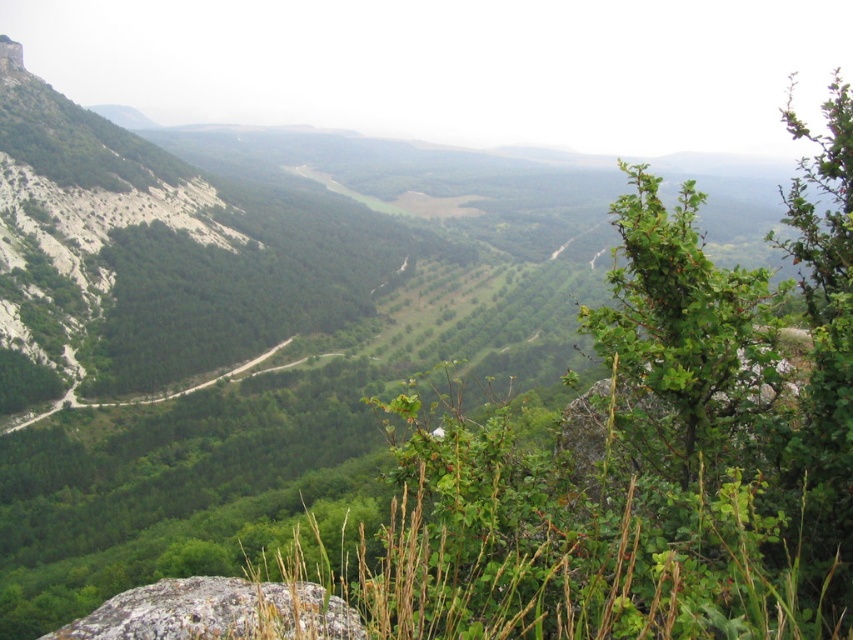
You are a hiker standing at the base of the gray rough rock at lower left and want to reach the smooth rock peak at upper left. Which rock is taller and requires more effort to climb?

The gray rough rock at lower left is taller than the smooth rock peak at upper left, so it would require more effort to climb.

You are standing at the top of the rocky outcrop looking down at the valley. There are two points marked on the image, one at coordinates point (77, 637) and another at point (4, 72). Which point is closer to your current position?

Point (77, 637) is closer to the camera than point (4, 72), so the point at coordinates point (77, 637) is closer to your current position.